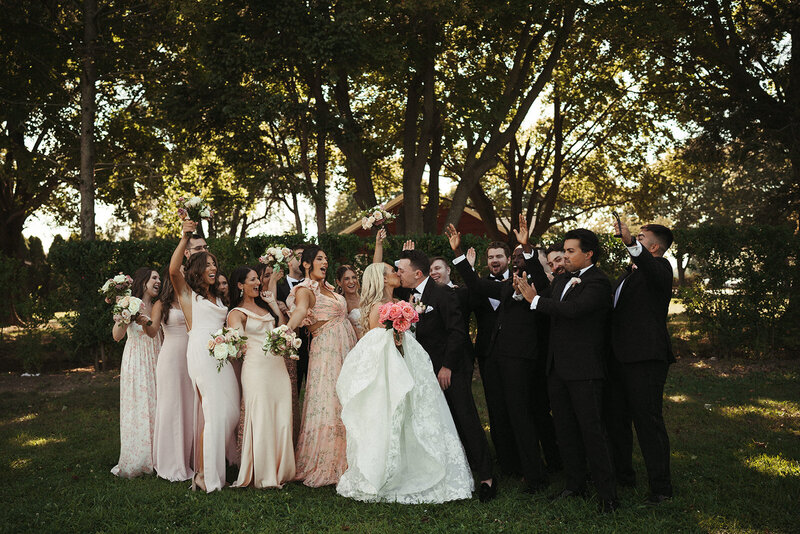
Identify the location of bouquets. Image resolution: width=800 pixels, height=534 pixels. (418, 310), (282, 341), (226, 343), (194, 207), (118, 277), (128, 305), (376, 219).